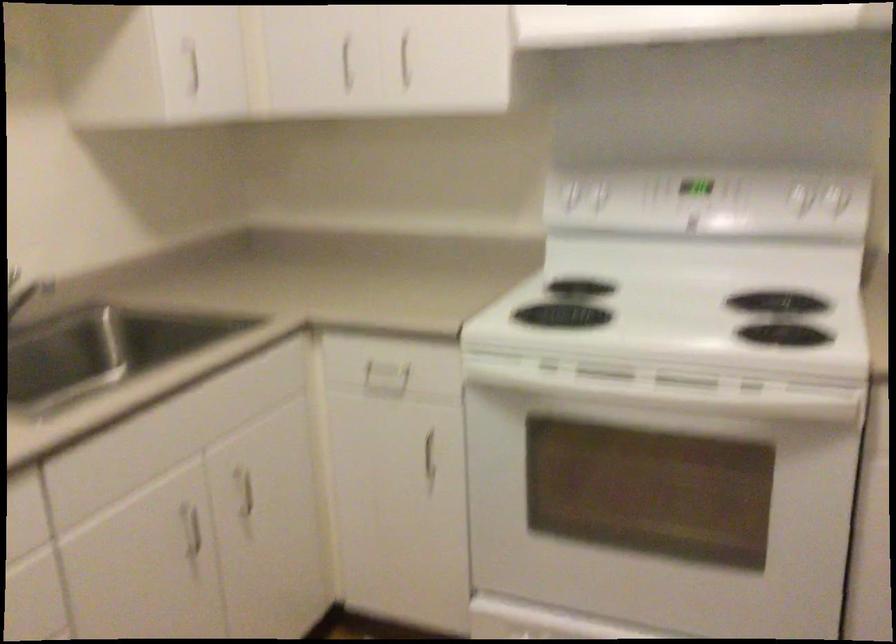
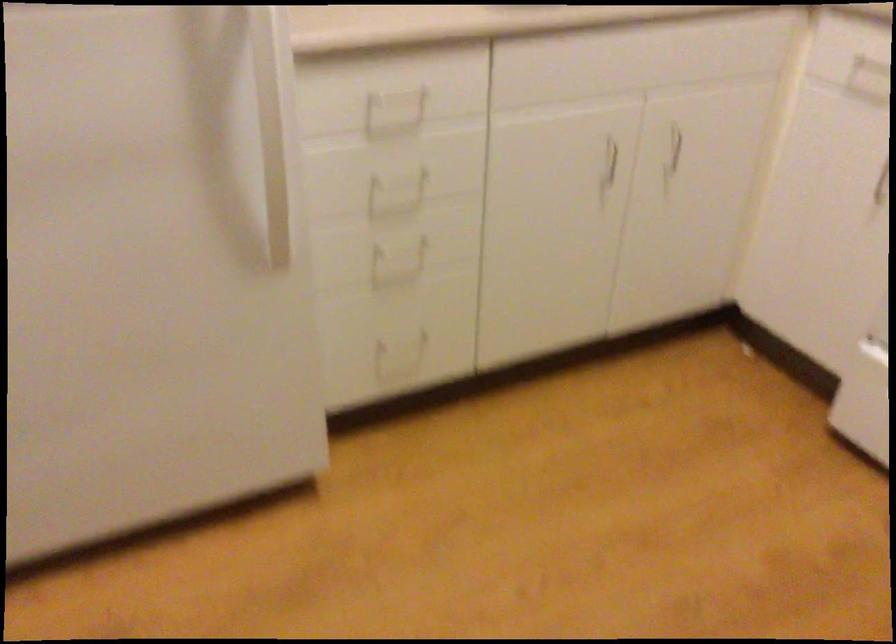
Where in the second image is the point corresponding to (x=190, y=533) from the first image?

(609, 161)